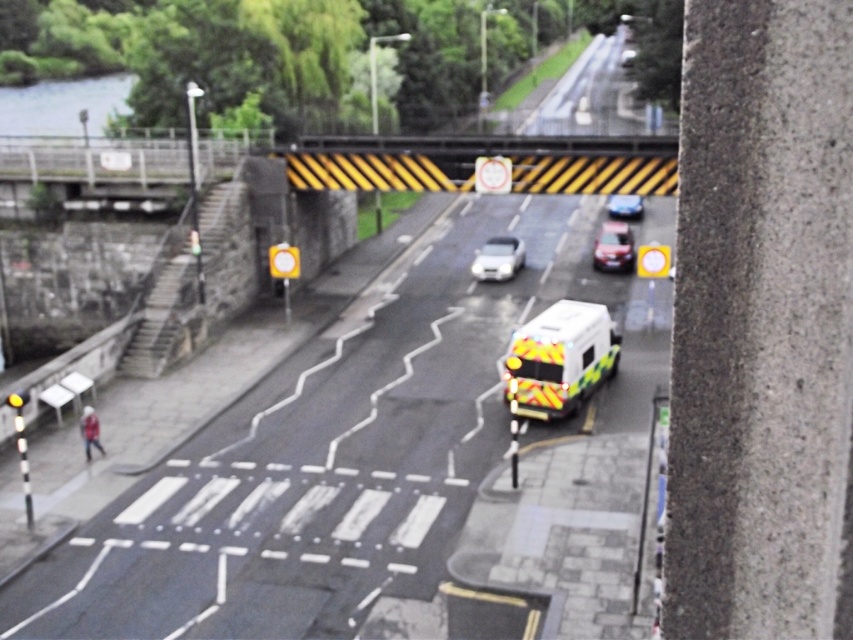
In the scene shown: Is white glossy car at center bigger than yellow reflective van at center?

Yes, white glossy car at center is bigger than yellow reflective van at center.

Can you confirm if white glossy car at center is wider than yellow reflective van at center?

Correct, the width of white glossy car at center exceeds that of yellow reflective van at center.

Who is more distant from viewer, (477, 272) or (631, 250)?

The point (631, 250) is more distant.

Locate an element on the screen. This screenshot has width=853, height=640. white glossy car at center is located at coordinates (498, 259).

Is white reflective van at center thinner than yellow reflective ambulance at center?

In fact, white reflective van at center might be wider than yellow reflective ambulance at center.

Identify the location of white reflective van at center. This screenshot has height=640, width=853. (347, 468).

Which is above, yellow reflective ambulance at center or shiny silver car at center?

shiny silver car at center is above.

Is yellow reflective ambulance at center bigger than shiny silver car at center?

No.

Which is behind, point (601, 321) or point (610, 216)?

Positioned behind is point (610, 216).

Image resolution: width=853 pixels, height=640 pixels. Find the location of `yellow reflective ambulance at center`. yellow reflective ambulance at center is located at coordinates (560, 358).